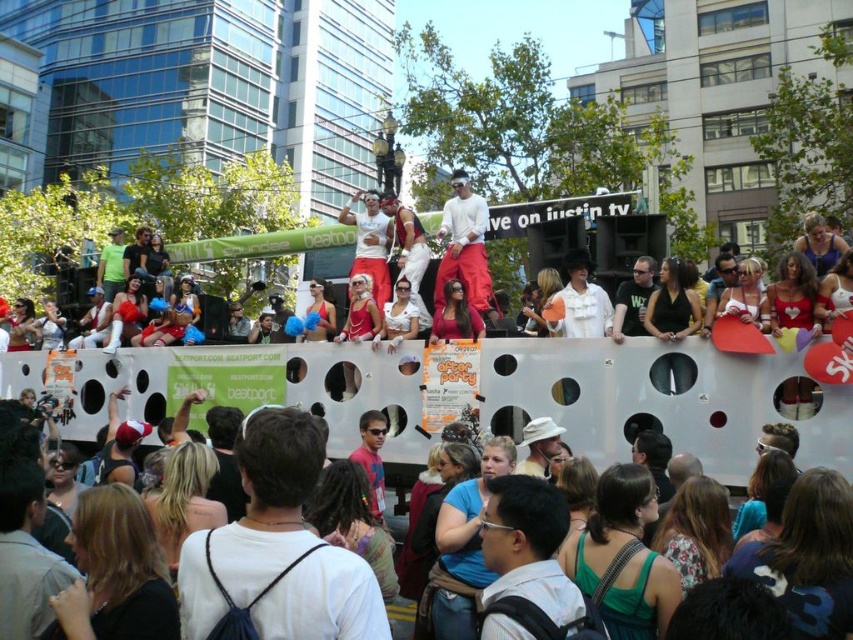
Is shiny metallic tank top at center above green fabric shirt at center?

Actually, shiny metallic tank top at center is below green fabric shirt at center.

Which is below, shiny metallic tank top at center or green fabric shirt at center?

shiny metallic tank top at center is below.

Is point (399, 262) positioned in front of point (114, 276)?

Yes, it is.

Locate an element on the screen. The height and width of the screenshot is (640, 853). shiny metallic tank top at center is located at coordinates (408, 250).

Does white matte backpack at center have a greater width compared to white matte shirt at center?

Incorrect, white matte backpack at center's width does not surpass white matte shirt at center's.

At what (x,y) coordinates should I click in order to perform the action: click on white matte backpack at center. Please return your answer as a coordinate pair (x, y). Looking at the image, I should click on (525, 554).

Locate an element on the screen. The image size is (853, 640). white matte backpack at center is located at coordinates (525, 554).

Measure the distance between point (469, 202) and camera.

The distance of point (469, 202) from camera is 57.48 meters.

Between white cotton shirt at center and white matte shirt at center, which one appears on the left side from the viewer's perspective?

white matte shirt at center is more to the left.

Between point (471, 275) and point (380, 257), which one is positioned behind?

Point (380, 257)

What are the coordinates of `white cotton shirt at center` in the screenshot? It's located at (463, 248).